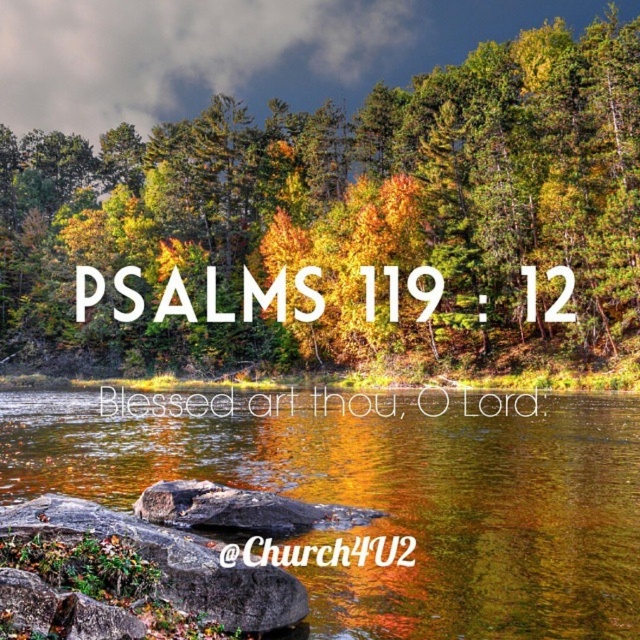
Question: Which point is closer to the camera?

Choices:
 (A) (240, 531)
 (B) (360, 593)
 (C) (216, 593)
 (D) (627, 300)

Answer: (C)

Question: Which of the following is the closest to the observer?

Choices:
 (A) gray rough rock at lower left
 (B) shiny reflective water at center
 (C) gray rough rock at center

Answer: (B)

Question: Which object is farther from the camera taking this photo?

Choices:
 (A) green matte tree at upper center
 (B) gray rough rock at center

Answer: (A)

Question: Can you confirm if green matte tree at upper center is bigger than shiny reflective water at center?

Choices:
 (A) yes
 (B) no

Answer: (A)

Question: Is gray rough rock at lower left to the left of gray rough rock at center from the viewer's perspective?

Choices:
 (A) yes
 (B) no

Answer: (A)

Question: Can you confirm if shiny reflective water at center is smaller than gray rough rock at lower left?

Choices:
 (A) no
 (B) yes

Answer: (A)